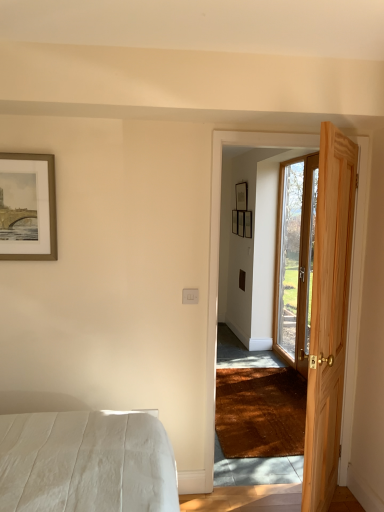
Question: Is gold-framed artwork at upper left, the 1th picture frame in the front-to-back sequence, outside natural wood door at right, which appears as the second door when viewed from the right?

Choices:
 (A) yes
 (B) no

Answer: (A)

Question: Considering the relative positions of gold-framed artwork at upper left, which ranks as the first picture frame in left-to-right order, and natural wood door at right, positioned as the first door in front-to-back order, in the image provided, is gold-framed artwork at upper left, which ranks as the first picture frame in left-to-right order, to the left of natural wood door at right, positioned as the first door in front-to-back order, from the viewer's perspective?

Choices:
 (A) no
 (B) yes

Answer: (B)

Question: Does gold-framed artwork at upper left, the 1th picture frame in the front-to-back sequence, lie behind natural wood door at right, which appears as the second door when viewed from the right?

Choices:
 (A) no
 (B) yes

Answer: (B)

Question: From a real-world perspective, is gold-framed artwork at upper left, arranged as the third picture frame when viewed from the back, physically above natural wood door at right, which appears as the second door when viewed from the right?

Choices:
 (A) no
 (B) yes

Answer: (B)

Question: Considering the relative sizes of gold-framed artwork at upper left, the 1th picture frame in the front-to-back sequence, and natural wood door at right, positioned as the first door in front-to-back order, in the image provided, is gold-framed artwork at upper left, the 1th picture frame in the front-to-back sequence, bigger than natural wood door at right, positioned as the first door in front-to-back order,?

Choices:
 (A) yes
 (B) no

Answer: (B)

Question: From a real-world perspective, is gold-framed artwork at upper left, which is the third picture frame from right to left, beneath natural wood door at right, which appears as the second door when viewed from the right?

Choices:
 (A) no
 (B) yes

Answer: (A)

Question: Does clear glass door at right, which is the 2th door from left to right, come behind gold-framed artwork at upper left, arranged as the third picture frame when viewed from the back?

Choices:
 (A) no
 (B) yes

Answer: (B)

Question: Is clear glass door at right, acting as the first door starting from the right, bigger than gold-framed artwork at upper left, the 1th picture frame in the front-to-back sequence?

Choices:
 (A) no
 (B) yes

Answer: (B)

Question: Is clear glass door at right, arranged as the first door when viewed from the back, thinner than gold-framed artwork at upper left, which ranks as the first picture frame in left-to-right order?

Choices:
 (A) no
 (B) yes

Answer: (A)

Question: Does clear glass door at right, arranged as the first door when viewed from the back, have a greater width compared to gold-framed artwork at upper left, which ranks as the first picture frame in left-to-right order?

Choices:
 (A) no
 (B) yes

Answer: (B)

Question: Is clear glass door at right, acting as the first door starting from the right, shorter than gold-framed artwork at upper left, arranged as the third picture frame when viewed from the back?

Choices:
 (A) no
 (B) yes

Answer: (A)

Question: Is clear glass door at right, acting as the first door starting from the right, located outside gold-framed artwork at upper left, arranged as the third picture frame when viewed from the back?

Choices:
 (A) yes
 (B) no

Answer: (A)

Question: Is clear glass door at right, arranged as the first door when viewed from the back, turned away from matte black picture frame at upper center, which is the 1th picture frame in back-to-front order?

Choices:
 (A) yes
 (B) no

Answer: (B)